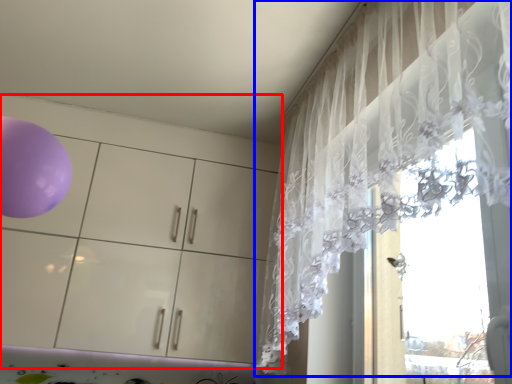
Question: Which of the following is the farthest to the observer, dresser (highlighted by a red box) or curtain (highlighted by a blue box)?

Choices:
 (A) dresser
 (B) curtain

Answer: (A)